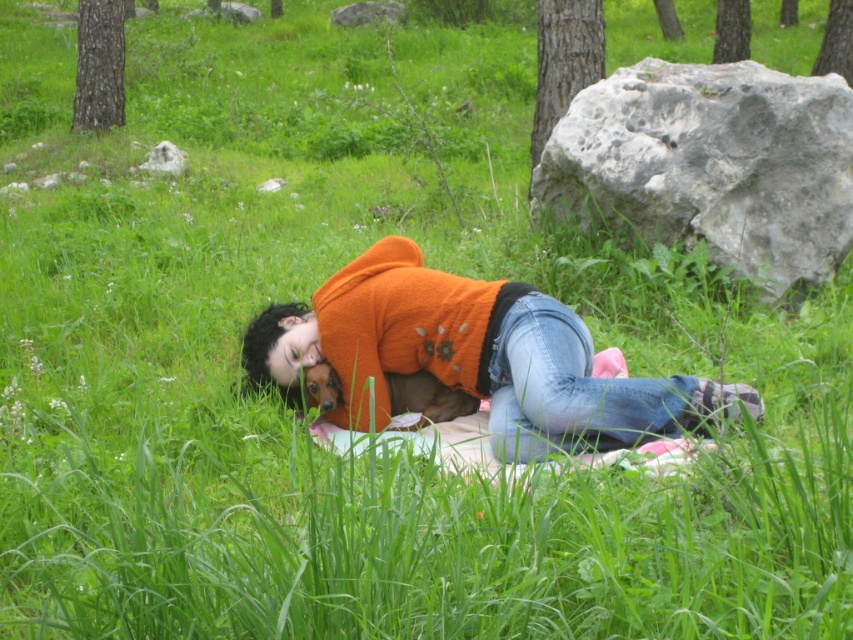
Question: Which object is positioned farthest from the orange fleece sweater at center?

Choices:
 (A) gray rough rock at upper right
 (B) gray rough rock at upper center

Answer: (B)

Question: Which object is positioned farthest from the gray rough rock at upper right?

Choices:
 (A) gray rough rock at upper center
 (B) orange fleece sweater at center

Answer: (A)

Question: Which object appears closest to the camera in this image?

Choices:
 (A) gray rough rock at upper center
 (B) gray rough rock at upper right

Answer: (B)

Question: Is gray rough rock at upper right behind orange fleece sweater at center?

Choices:
 (A) yes
 (B) no

Answer: (A)

Question: Can you confirm if orange fleece sweater at center is positioned below gray rough rock at upper center?

Choices:
 (A) no
 (B) yes

Answer: (B)

Question: Is orange fleece sweater at center below gray rough rock at upper center?

Choices:
 (A) no
 (B) yes

Answer: (B)